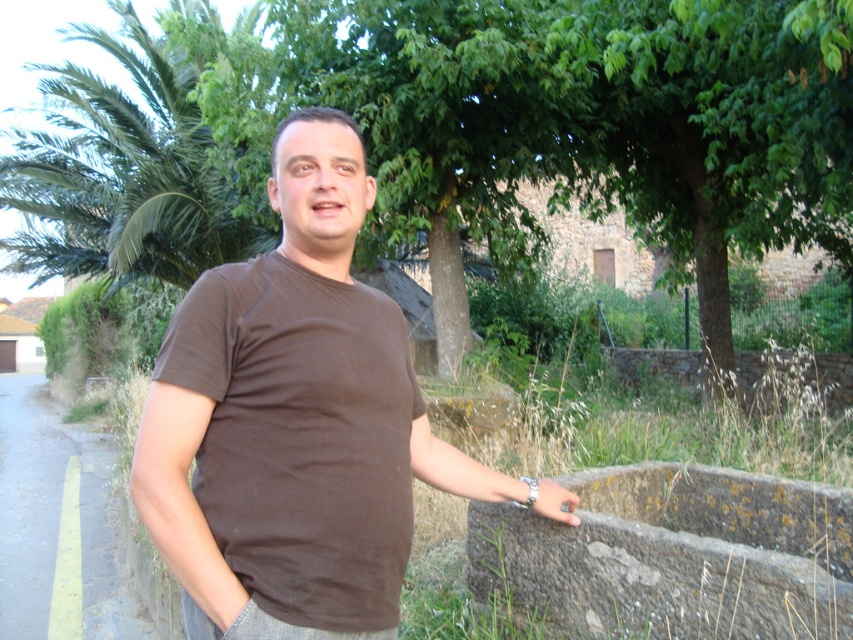
Question: Is the position of matte brown t-shirt at center more distant than that of green leafy palm tree at left?

Choices:
 (A) yes
 (B) no

Answer: (B)

Question: Which of the following is the farthest from the observer?

Choices:
 (A) [33, 292]
 (B) [544, 496]
 (C) [248, 371]
 (D) [347, 292]

Answer: (A)

Question: Can you confirm if brown cotton t-shirt at center is thinner than matte brown hand at lower right?

Choices:
 (A) no
 (B) yes

Answer: (A)

Question: Which of the following is the farthest from the observer?

Choices:
 (A) matte brown t-shirt at center
 (B) brown cotton t-shirt at center
 (C) matte brown hand at lower right
 (D) green leafy palm tree at left

Answer: (D)

Question: From the image, what is the correct spatial relationship of brown cotton t-shirt at center in relation to matte brown t-shirt at center?

Choices:
 (A) above
 (B) below

Answer: (B)

Question: Estimate the real-world distances between objects in this image. Which object is farther from the matte brown t-shirt at center?

Choices:
 (A) matte brown hand at lower right
 (B) green leafy palm tree at left

Answer: (B)